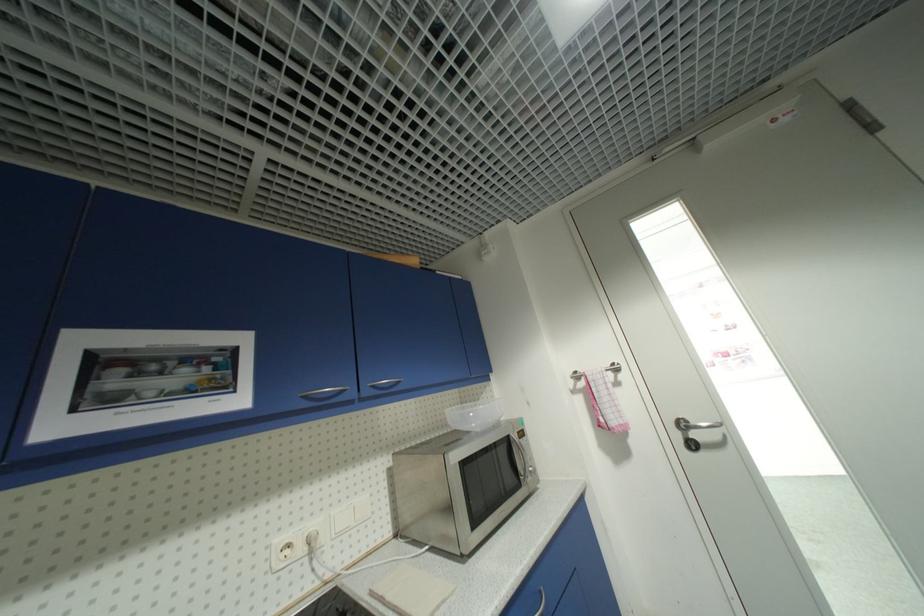
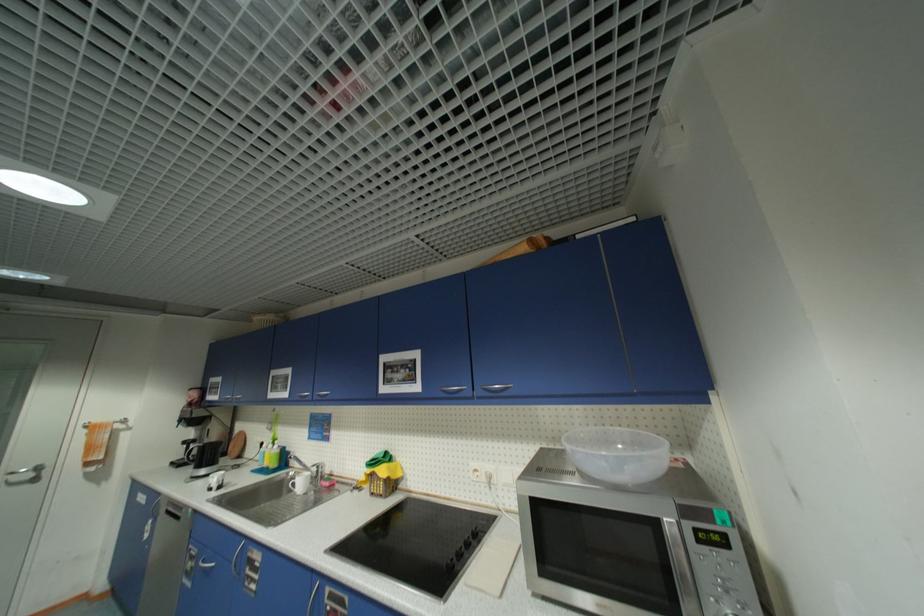
Where in the second image is the point corresponding to (x=311, y=399) from the first image?

(448, 392)